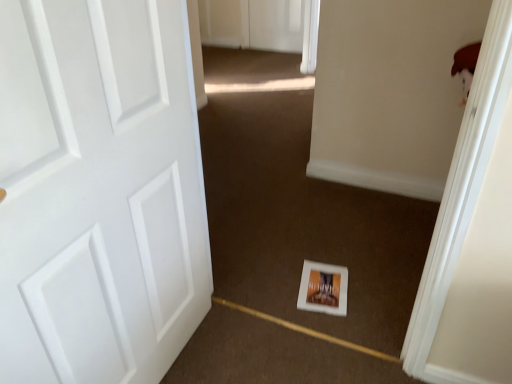
The height and width of the screenshot is (384, 512). Find the location of `free space in front of white matte postcard at center`. free space in front of white matte postcard at center is located at coordinates (345, 323).